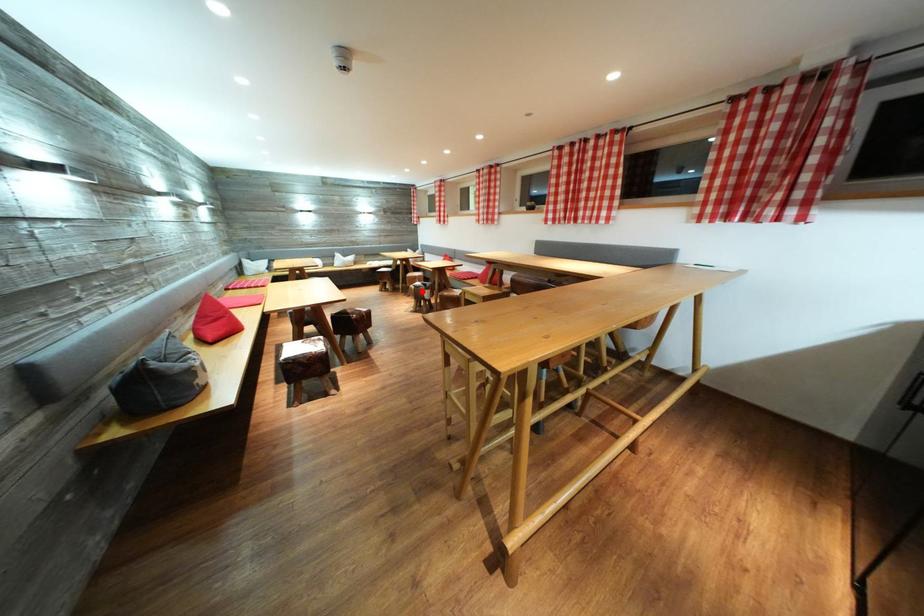
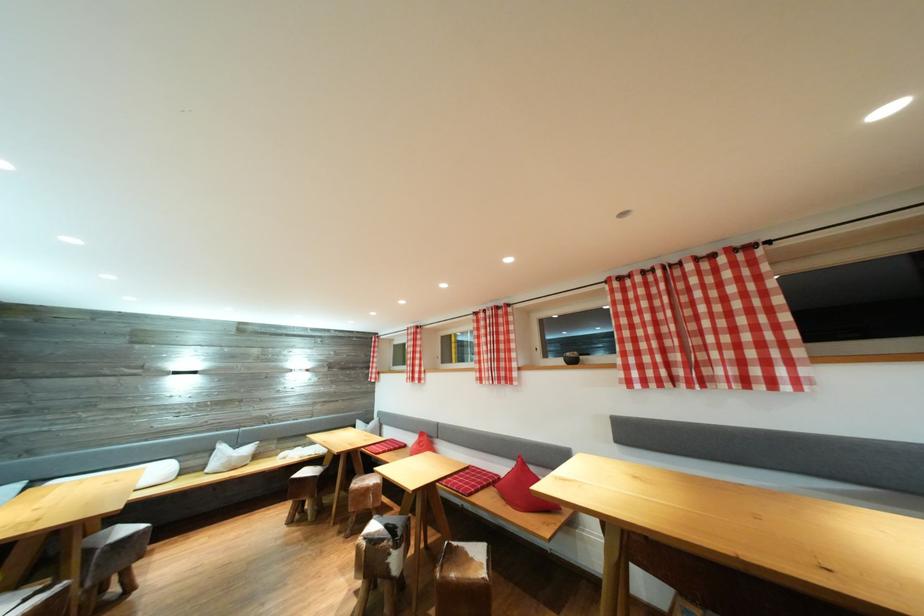
Question: I am providing you with two images of the same scene from different viewpoints. Image1 has a red point marked. In image2, the corresponding 3D location appears at what relative position? Reply with the corresponding letter.

Choices:
 (A) Closer
 (B) Farther

Answer: (B)